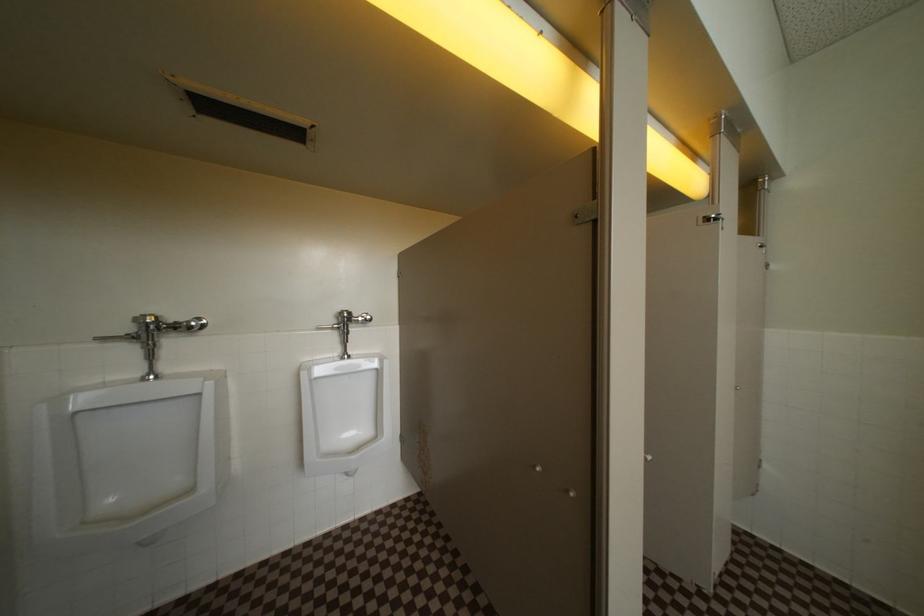
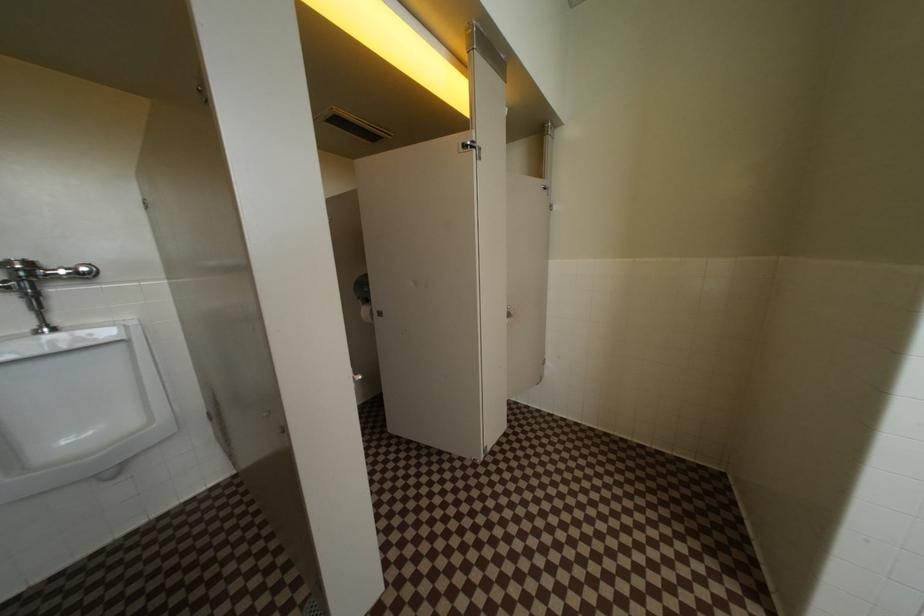
Question: In a continuous first-person perspective shot, in which direction is the camera moving?

Choices:
 (A) Left
 (B) Right
 (C) Forward
 (D) Backward

Answer: (B)